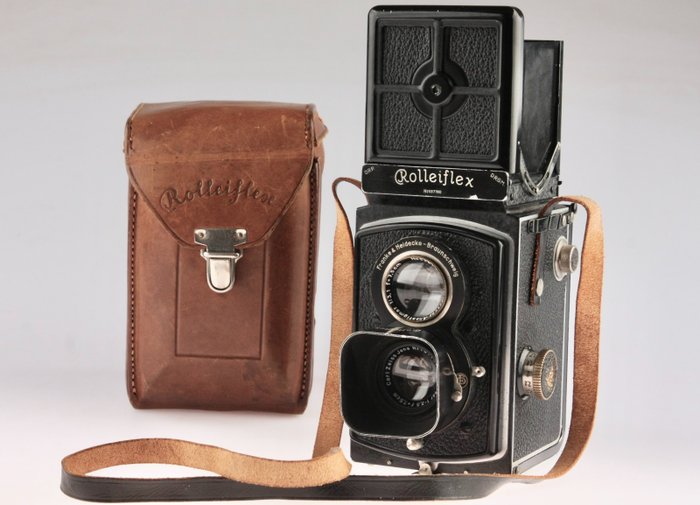
Find the location of `glass`. glass is located at coordinates (402, 309).